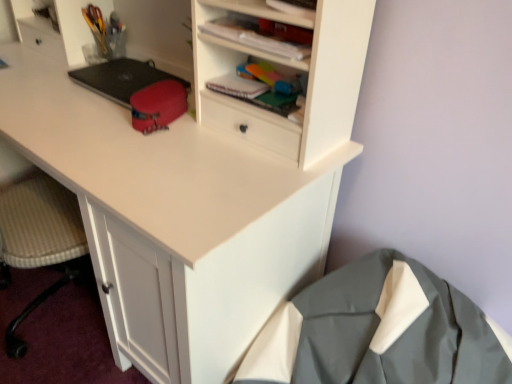
Where is `free spot above matte red pouch at center, which is the 2th stationery in left-to-right order (from a real-world perspective)`? free spot above matte red pouch at center, which is the 2th stationery in left-to-right order (from a real-world perspective) is located at coordinates (156, 85).